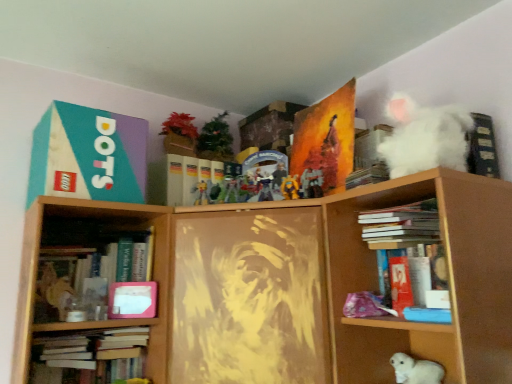
The width and height of the screenshot is (512, 384). In order to click on empty space that is ontop of hardcover book at left, which ranks as the 4th book in right-to-left order (from a real-world perspective) in this screenshot , I will do `click(95, 234)`.